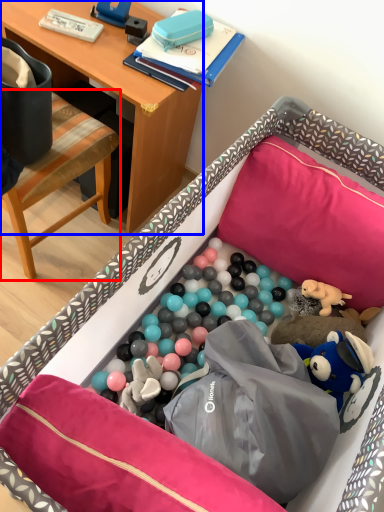
Question: Which object is further to the camera taking this photo, chair (highlighted by a red box) or desk (highlighted by a blue box)?

Choices:
 (A) chair
 (B) desk

Answer: (B)